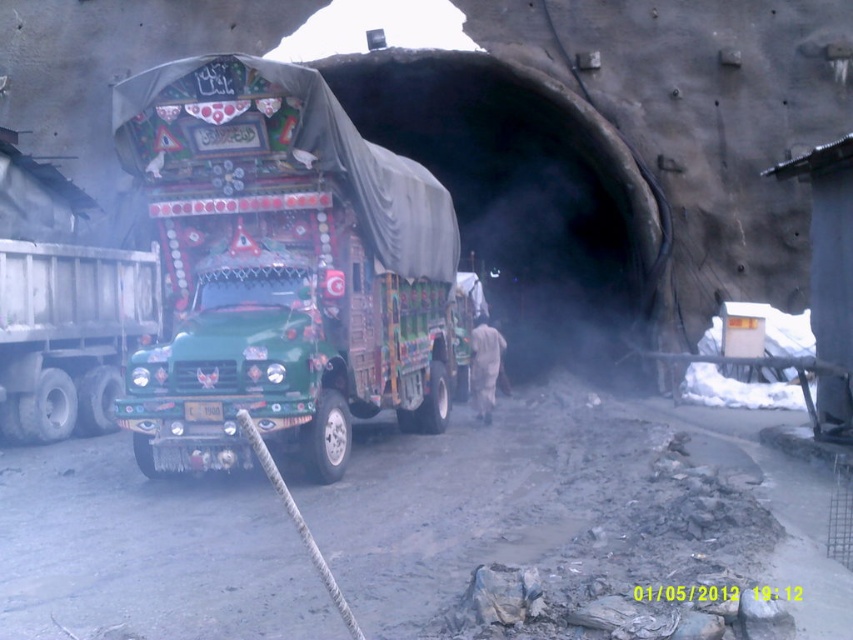
You are a construction worker standing at the tunnel entrance. You need to move the green painted truck at center and the green matte trailer truck at left. Which truck should you move first if you want to exit the tunnel area first?

The green matte trailer truck at left should be moved first because the green painted truck at center is positioned to its right, blocking the exit path.

Looking at this image, you are a delivery driver who needs to navigate through a narrow alley that can only accommodate vehicles up to 2.5 meters in width. You have two options for your route today. You can either take the green painted truck at center or the green matte trailer truck at left. Based on their widths, which truck should you choose to ensure you can pass through the narrow alley?

The green painted truck at center might be wider than green matte trailer truck at left. Therefore, you should choose the green matte trailer truck at left to ensure it can pass through the narrow alley since it is likely narrower than the width limit.